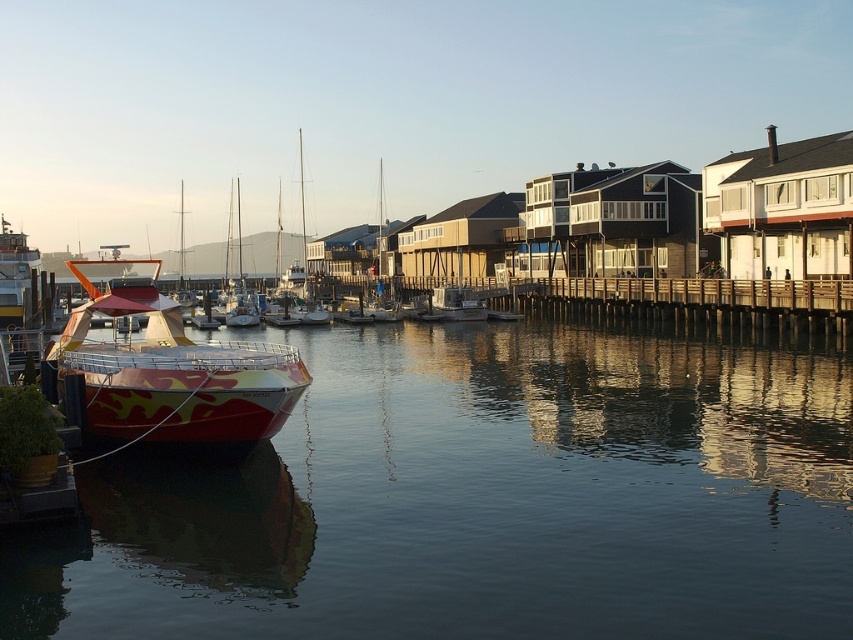
Question: Which of the following is the farthest from the observer?

Choices:
 (A) pyautogui.click(x=96, y=385)
 (B) pyautogui.click(x=445, y=305)

Answer: (B)

Question: Considering the real-world distances, which object is closest to the wooden at right?

Choices:
 (A) shiny white sailboat at center
 (B) glossy water at lower left

Answer: (B)

Question: Does camouflage paintwork boat at left appear on the left side of wooden at right?

Choices:
 (A) no
 (B) yes

Answer: (B)

Question: Can you confirm if wooden at right is smaller than white glossy boat at center?

Choices:
 (A) no
 (B) yes

Answer: (A)

Question: Does camouflage paintwork boat at left appear under shiny white sailboat at center?

Choices:
 (A) yes
 (B) no

Answer: (A)

Question: Which point appears farthest from the camera in this image?

Choices:
 (A) (711, 618)
 (B) (476, 314)
 (C) (300, 236)
 (D) (254, 362)

Answer: (C)